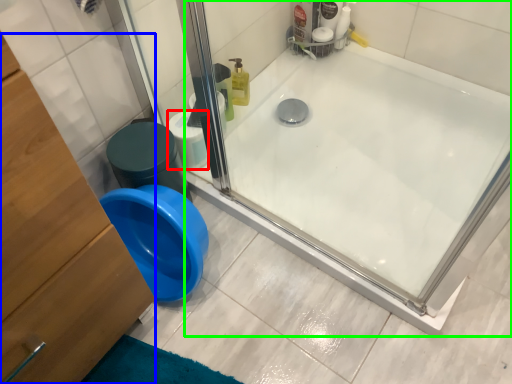
Question: Based on their relative distances, which object is nearer to toilet paper (highlighted by a red box)? Choose from dresser (highlighted by a blue box) and bathtub (highlighted by a green box).

Choices:
 (A) dresser
 (B) bathtub

Answer: (B)